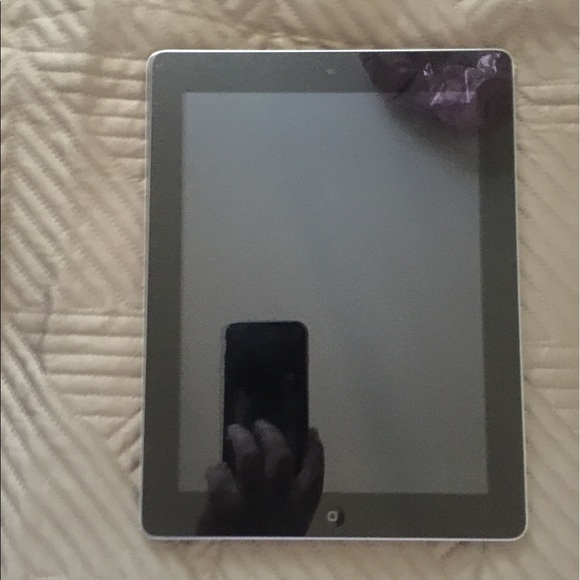
At what (x,y) coordinates should I click in order to perform the action: click on tablet bezel. Please return your answer as a coordinate pair (x, y). Looking at the image, I should click on (409, 506).